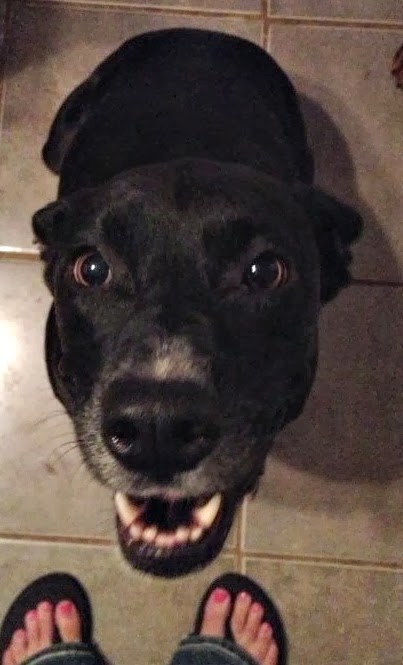
The image size is (403, 665). Find the location of `grout`. grout is located at coordinates (78, 538).